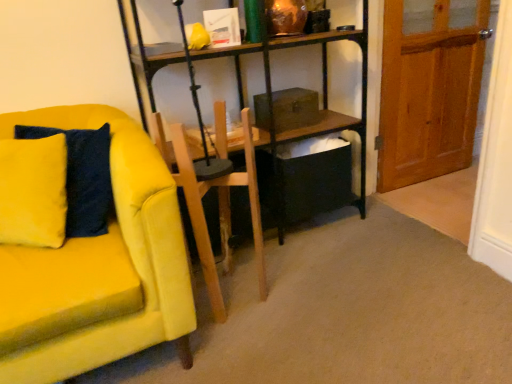
This screenshot has width=512, height=384. I want to click on vacant area that lies to the right of wooden armchair at center, so click(294, 286).